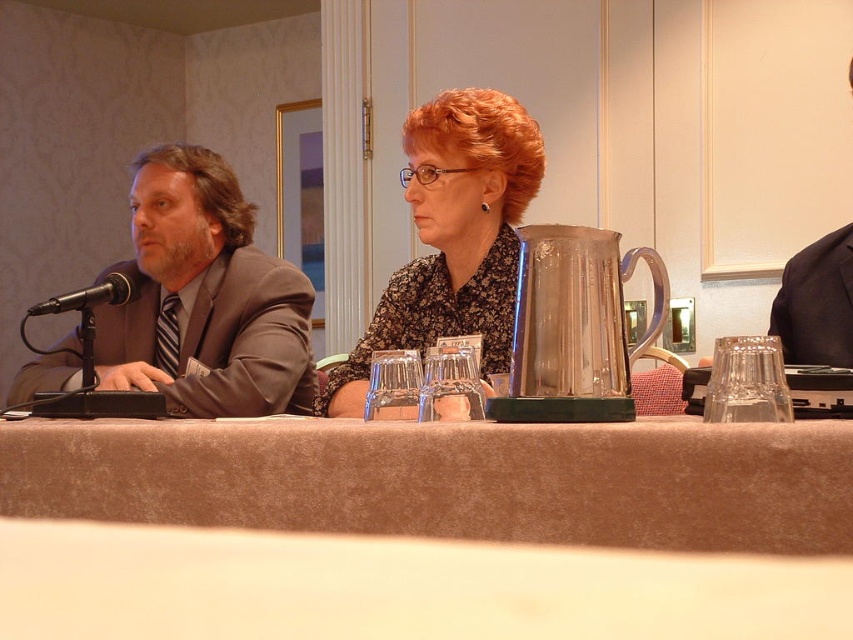
Question: Can you confirm if floral-patterned blouse at center is smaller than black metallic microphone at left?

Choices:
 (A) no
 (B) yes

Answer: (A)

Question: Which object is positioned closest to the dark blue fabric business suit at right?

Choices:
 (A) black metallic microphone at left
 (B) floral-patterned blouse at center
 (C) brown fabric table at center
 (D) matte gray suit at left

Answer: (B)

Question: Which of the following is the farthest from the observer?

Choices:
 (A) black metallic microphone at left
 (B) dark blue fabric business suit at right
 (C) brown fabric table at center
 (D) matte gray suit at left

Answer: (B)

Question: Which of the following is the closest to the observer?

Choices:
 (A) floral-patterned blouse at center
 (B) brown fabric table at center

Answer: (B)

Question: Observing the image, what is the correct spatial positioning of matte gray suit at left in reference to floral-patterned blouse at center?

Choices:
 (A) above
 (B) below

Answer: (B)

Question: Is brown fabric table at center to the left of floral-patterned blouse at center from the viewer's perspective?

Choices:
 (A) no
 (B) yes

Answer: (B)